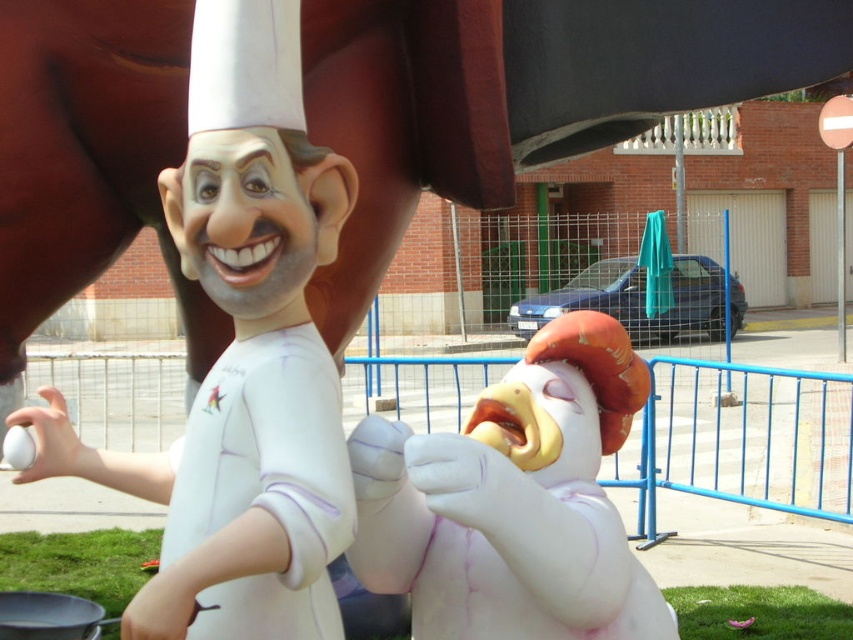
Is smooth white chicken at center thinner than white matte chef at center?

Yes, smooth white chicken at center is thinner than white matte chef at center.

The width and height of the screenshot is (853, 640). In order to click on smooth white chicken at center in this screenshot , I will do `click(514, 500)`.